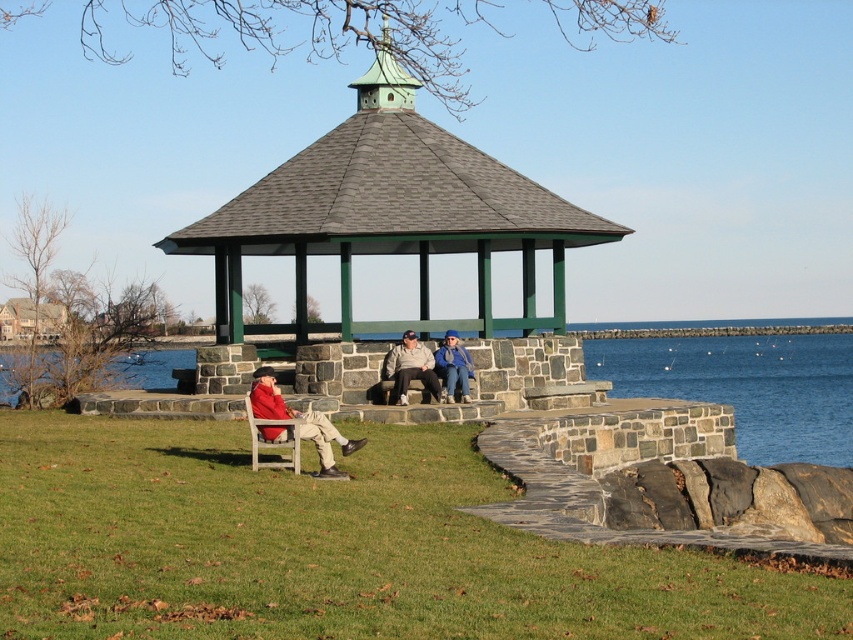
Does matte red jacket at lower left appear over matte gray stone bench at center?

No, matte red jacket at lower left is not above matte gray stone bench at center.

Does matte red jacket at lower left appear on the left side of matte gray stone bench at center?

Yes, matte red jacket at lower left is to the left of matte gray stone bench at center.

What do you see at coordinates (300, 420) in the screenshot? Image resolution: width=853 pixels, height=640 pixels. I see `matte red jacket at lower left` at bounding box center [300, 420].

In order to click on matte red jacket at lower left in this screenshot , I will do `click(300, 420)`.

Does green shingled gazebo at center appear over blue denim jacket at center?

Yes.

Does green shingled gazebo at center appear on the right side of blue denim jacket at center?

In fact, green shingled gazebo at center is to the left of blue denim jacket at center.

Who is more distant from viewer, (302, 256) or (444, 342)?

Point (302, 256)

This screenshot has width=853, height=640. I want to click on green shingled gazebo at center, so click(x=390, y=212).

Is matte red jacket at lower left positioned behind blue denim jacket at center?

No, it is in front of blue denim jacket at center.

Between matte red jacket at lower left and blue denim jacket at center, which one has less height?

matte red jacket at lower left

Does point (302, 416) lie in front of point (454, 381)?

Yes.

Where is `matte red jacket at lower left`? matte red jacket at lower left is located at coordinates (300, 420).